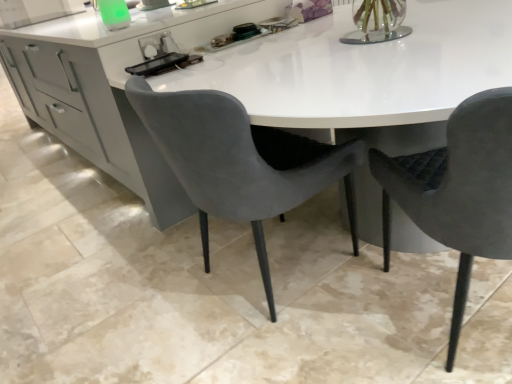
Find the location of a particular element. vacant position to the left of velvet grey chair at center, the first chair when ordered from left to right is located at coordinates (135, 297).